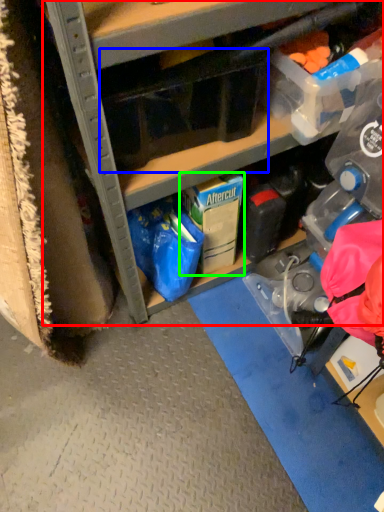
Question: Based on their relative distances, which object is farther from cabinetry (highlighted by a red box)? Choose from storage box (highlighted by a blue box) and storage box (highlighted by a green box).

Choices:
 (A) storage box
 (B) storage box

Answer: (B)